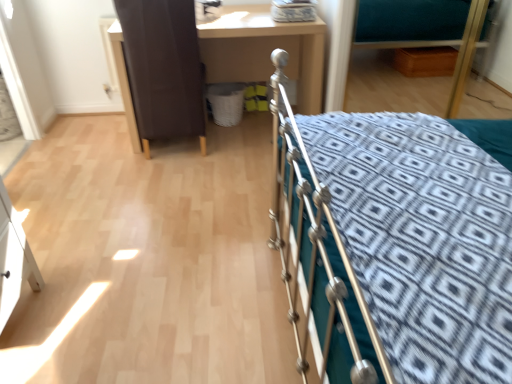
What are the coordinates of `vacant space that's between matte brown desk at center and brown leather screen door at upper left` in the screenshot? It's located at (226, 149).